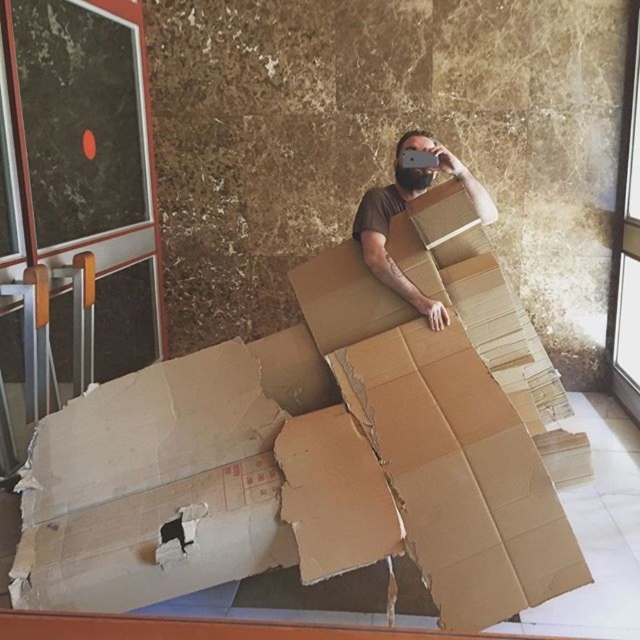
You are an interior designer assessing the space. You notice the brown corrugated cardboard at center and the brown cardboard at center. Which one is positioned to the left?

The brown corrugated cardboard at center is to the left of brown cardboard at center.